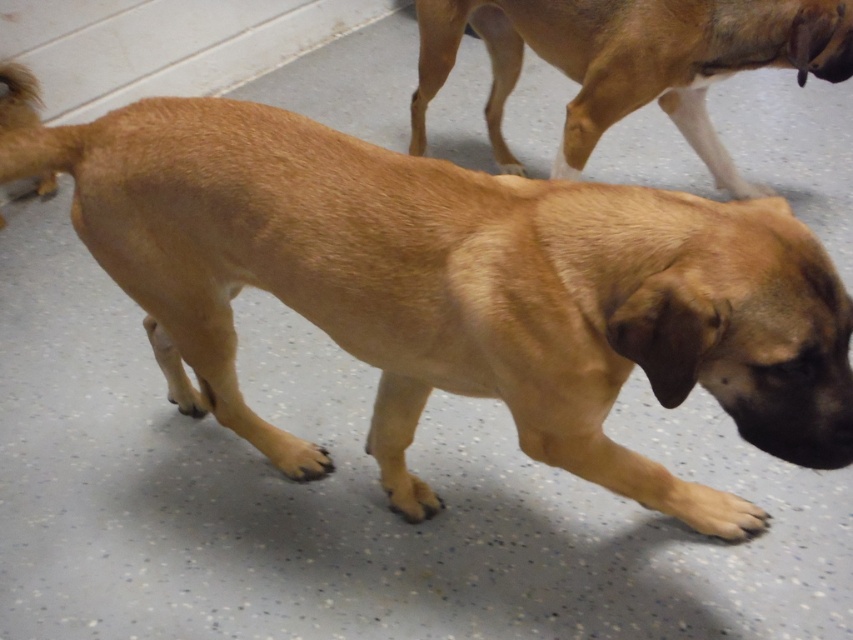
Can you confirm if brown fur dog at center is positioned to the right of brown furry dog at upper right?

Incorrect, brown fur dog at center is not on the right side of brown furry dog at upper right.

Consider the image. Does brown fur dog at center lie in front of brown furry dog at upper right?

Yes.

Is point (10, 163) positioned in front of point (728, 188)?

Yes, it is.

Find the location of `brown fur dog at center`. brown fur dog at center is located at coordinates (457, 291).